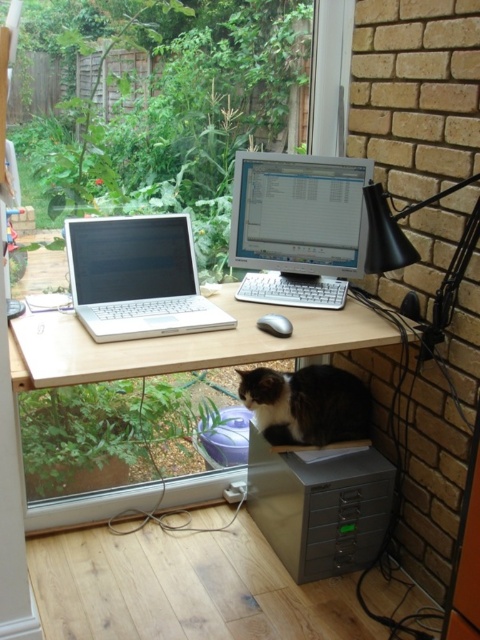
You are trying to hang a picture frame that is 20 inches wide on the wall behind the desk. The frame needs to be centered between the transparent glass window at upper center and the matte silver monitor at center. Based on their widths, can you determine if there will be enough space between them to fit the frame?

The transparent glass window at upper center might be wider than matte silver monitor at center, so the space between them may vary. To ensure the frame fits, measure the distance between the two objects first before hanging it.